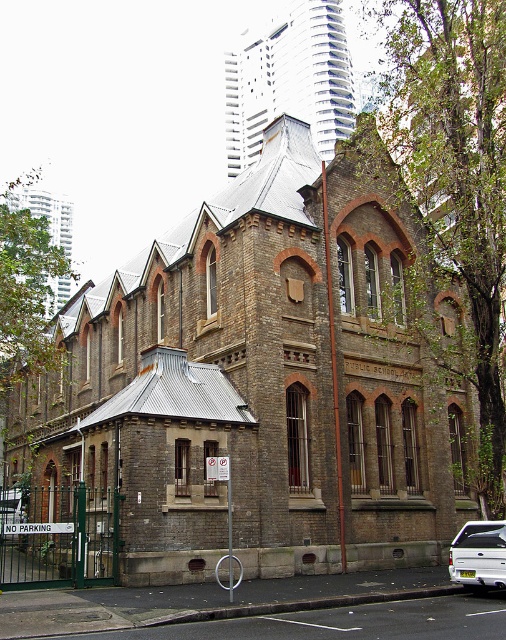
Question: Among these points, which one is farthest from the camera?

Choices:
 (A) (497, 582)
 (B) (147, 406)

Answer: (B)

Question: Does brown brick church at center appear on the left side of white matte pickup truck at lower right?

Choices:
 (A) yes
 (B) no

Answer: (A)

Question: Is brown brick church at center to the right of white matte pickup truck at lower right from the viewer's perspective?

Choices:
 (A) yes
 (B) no

Answer: (B)

Question: Estimate the real-world distances between objects in this image. Which object is closer to the white matte pickup truck at lower right?

Choices:
 (A) brick church at upper center
 (B) brown brick church at center

Answer: (B)

Question: Can you confirm if brick church at upper center is positioned to the right of white matte pickup truck at lower right?

Choices:
 (A) yes
 (B) no

Answer: (B)

Question: Which point appears farthest from the camera in this image?

Choices:
 (A) (319, 250)
 (B) (454, 564)

Answer: (A)